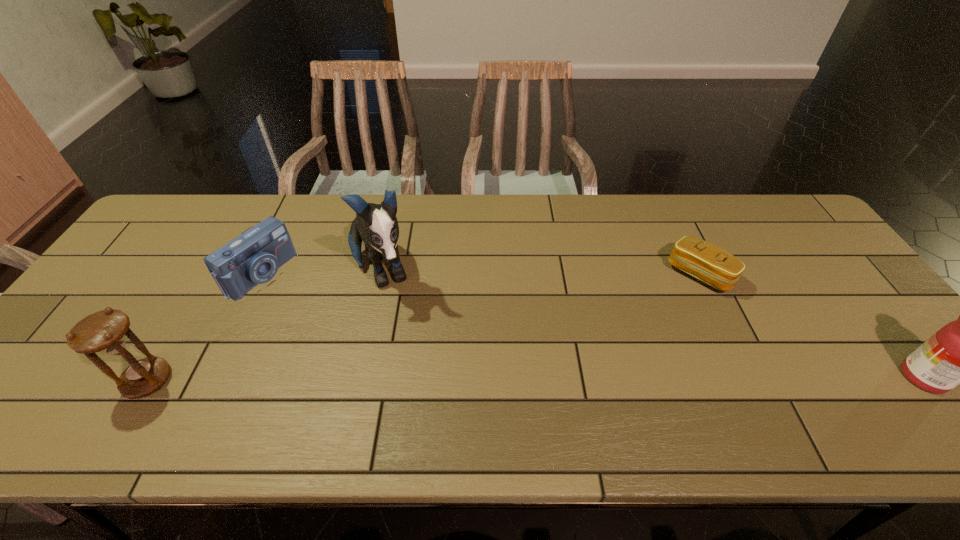
The image size is (960, 540). Find the location of `empty location between the shortest object and the second object from left to right`. empty location between the shortest object and the second object from left to right is located at coordinates (480, 274).

Identify the location of vacant space that is in between the fourth tallest object and the second object from right to left. (480, 274).

Identify the location of vacant region between the second shortest object and the fourth object from left to right. tap(480, 274).

This screenshot has height=540, width=960. What are the coordinates of `free spot between the third shortest object and the puppy` in the screenshot? It's located at (265, 326).

Find the location of a particular element. The height and width of the screenshot is (540, 960). vacant area between the third tallest object and the fruit juice is located at coordinates (536, 379).

This screenshot has height=540, width=960. I want to click on empty space that is in between the camera and the fourth object from left to right, so click(x=480, y=274).

The width and height of the screenshot is (960, 540). In order to click on free space between the puppy and the hourglass in this screenshot , I will do `click(265, 326)`.

Where is `vacant space in between the third object from right to left and the leftmost object`? This screenshot has width=960, height=540. vacant space in between the third object from right to left and the leftmost object is located at coordinates (265, 326).

Identify the location of free space between the shortest object and the hourglass. click(x=423, y=327).

Image resolution: width=960 pixels, height=540 pixels. I want to click on free spot between the third object from right to left and the rightmost object, so click(x=653, y=325).